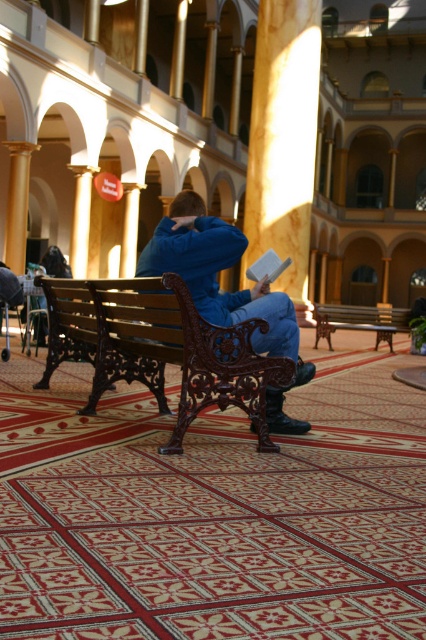
Question: Does smooth wooden pillar at center appear on the right side of white matte book at center?

Choices:
 (A) yes
 (B) no

Answer: (A)

Question: Which object is positioned farthest from the white matte book at center?

Choices:
 (A) brown wooden bench at center
 (B) smooth wooden pillar at center
 (C) polished dark wood bench at center
 (D) blue fleece jacket at center

Answer: (B)

Question: Is the position of polished dark wood bench at center more distant than that of brown wooden bench at center?

Choices:
 (A) yes
 (B) no

Answer: (B)

Question: Which of the following is the closest to the observer?

Choices:
 (A) smooth wooden pillar at center
 (B) brown wooden bench at center
 (C) polished dark wood bench at center

Answer: (C)

Question: Which of these objects is positioned closest to the white matte book at center?

Choices:
 (A) polished dark wood bench at center
 (B) smooth wooden pillar at center
 (C) brown wooden bench at center

Answer: (A)

Question: Does blue fleece jacket at center have a smaller size compared to white matte book at center?

Choices:
 (A) no
 (B) yes

Answer: (A)